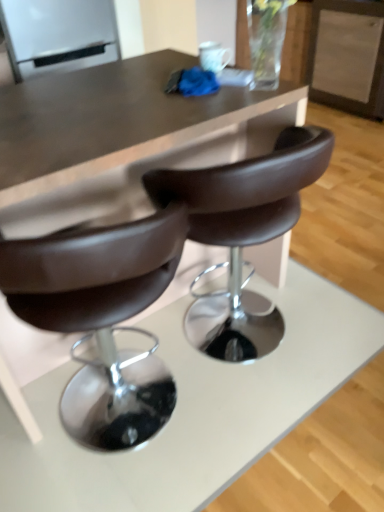
Question: From the image's perspective, does brown leather chair at center appear lower than matte brown table at center?

Choices:
 (A) yes
 (B) no

Answer: (A)

Question: Can you confirm if brown leather chair at center is shorter than matte brown table at center?

Choices:
 (A) no
 (B) yes

Answer: (B)

Question: Is brown leather chair at center smaller than matte brown table at center?

Choices:
 (A) yes
 (B) no

Answer: (A)

Question: Can you confirm if brown leather chair at center is positioned to the left of matte brown table at center?

Choices:
 (A) yes
 (B) no

Answer: (B)

Question: Can you confirm if brown leather chair at center is thinner than matte brown table at center?

Choices:
 (A) no
 (B) yes

Answer: (B)

Question: Does brown leather chair at center have a greater width compared to matte brown table at center?

Choices:
 (A) yes
 (B) no

Answer: (B)

Question: Considering the relative positions of white glossy refrigerator at upper left and brown leather chair at center in the image provided, is white glossy refrigerator at upper left to the left of brown leather chair at center from the viewer's perspective?

Choices:
 (A) no
 (B) yes

Answer: (B)

Question: Is white glossy refrigerator at upper left far away from brown leather chair at center?

Choices:
 (A) yes
 (B) no

Answer: (A)

Question: From the image's perspective, would you say white glossy refrigerator at upper left is shown under brown leather chair at center?

Choices:
 (A) yes
 (B) no

Answer: (B)

Question: Is the surface of white glossy refrigerator at upper left in direct contact with brown leather chair at center?

Choices:
 (A) yes
 (B) no

Answer: (B)

Question: Is white glossy refrigerator at upper left facing away from brown leather chair at center?

Choices:
 (A) yes
 (B) no

Answer: (B)

Question: Does white glossy refrigerator at upper left have a larger size compared to brown leather chair at center?

Choices:
 (A) yes
 (B) no

Answer: (B)

Question: Can you confirm if brown leather chair at center is shorter than white glossy refrigerator at upper left?

Choices:
 (A) no
 (B) yes

Answer: (A)